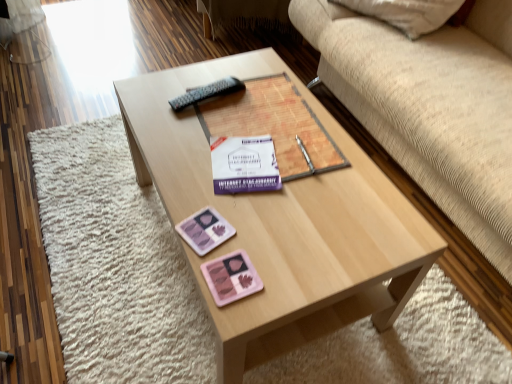
Locate an element on the screen. Image resolution: width=512 pixels, height=384 pixels. vacant area that is situated to the right of white paper at center is located at coordinates (313, 175).